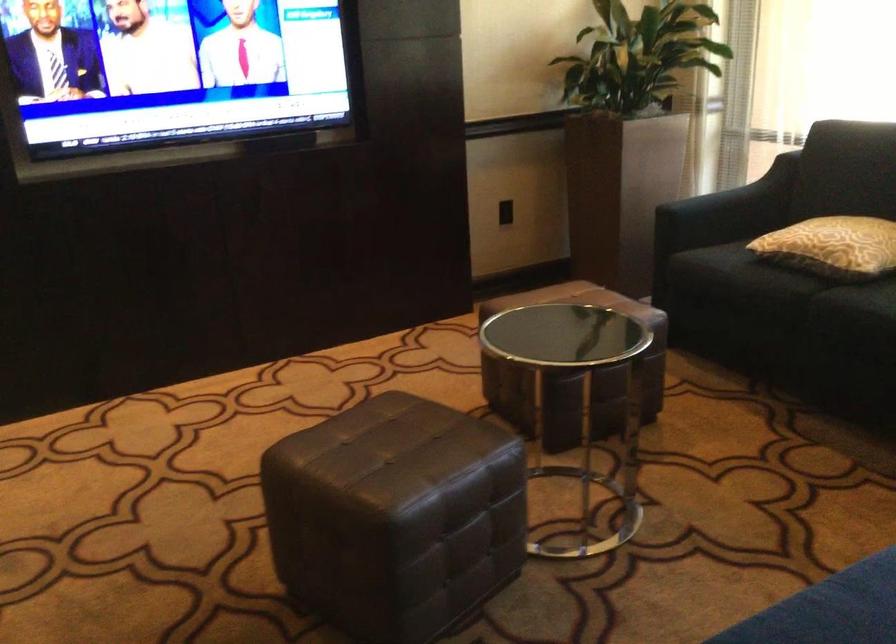
Where would you sit the sofa sitting surface? Please return your answer as a coordinate pair (x, y).

(767, 283)